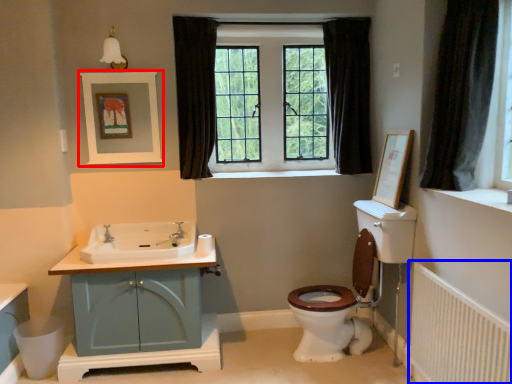
Question: Among these objects, which one is nearest to the camera, picture frame (highlighted by a red box) or radiator (highlighted by a blue box)?

Choices:
 (A) picture frame
 (B) radiator

Answer: (B)